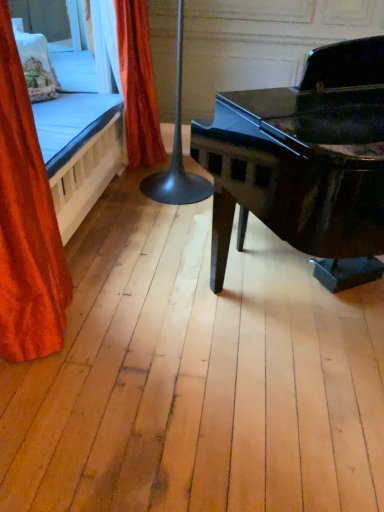
This screenshot has height=512, width=384. Identify the location of orange velvet curtain at left, the second curtain positioned from the back. (26, 224).

Locate an element on the screen. Image resolution: width=384 pixels, height=512 pixels. embroidered fabric pillow at upper left is located at coordinates (37, 66).

I want to click on black glossy table lamp at center, so click(177, 154).

Describe the element at coordinates (138, 84) in the screenshot. I see `orange velvet curtain at upper left, which ranks as the 2th curtain in front-to-back order` at that location.

How much space does orange velvet curtain at upper left, the first curtain in the back-to-front sequence, occupy horizontally?

It is 16.22 inches.

Locate an element on the screen. orange velvet curtain at left, the second curtain positioned from the back is located at coordinates (26, 224).

Can you tell me how much orange velvet curtain at left, the second curtain positioned from the back, and orange velvet curtain at upper left, which ranks as the 2th curtain in front-to-back order, differ in facing direction?

They differ by 0.00102 degrees in their facing directions.

In the scene shown: Considering the relative sizes of orange velvet curtain at left, marked as the 1th curtain in a front-to-back arrangement, and orange velvet curtain at upper left, which ranks as the 2th curtain in front-to-back order, in the image provided, is orange velvet curtain at left, marked as the 1th curtain in a front-to-back arrangement, wider than orange velvet curtain at upper left, which ranks as the 2th curtain in front-to-back order,?

No.

From a real-world perspective, between orange velvet curtain at left, marked as the 1th curtain in a front-to-back arrangement, and orange velvet curtain at upper left, the first curtain in the back-to-front sequence, who is vertically higher?

orange velvet curtain at left, marked as the 1th curtain in a front-to-back arrangement, from a real-world perspective.

Considering the positions of point (3, 185) and point (140, 47), is point (3, 185) closer or farther from the camera than point (140, 47)?

Clearly, point (3, 185) is closer to the camera than point (140, 47).

Can you confirm if black glossy table lamp at center is positioned to the right of orange velvet curtain at upper left, which ranks as the 2th curtain in front-to-back order?

Correct, you'll find black glossy table lamp at center to the right of orange velvet curtain at upper left, which ranks as the 2th curtain in front-to-back order.

Is black glossy table lamp at center bigger or smaller than orange velvet curtain at upper left, which ranks as the 2th curtain in front-to-back order?

Considering their sizes, black glossy table lamp at center takes up more space than orange velvet curtain at upper left, which ranks as the 2th curtain in front-to-back order.

From the image's perspective, between black glossy table lamp at center and orange velvet curtain at upper left, which ranks as the 2th curtain in front-to-back order, who is located below?

black glossy table lamp at center.

From the picture: From a real-world perspective, which object stands above the other?

black glossy table lamp at center.

From the black glossy table lamp at center, count the 2nd curtain to the left and point to it. Please provide its 2D coordinates.

[(26, 224)]

Who is smaller, black glossy table lamp at center or orange velvet curtain at left, the second curtain positioned from the back?

With smaller size is orange velvet curtain at left, the second curtain positioned from the back.

Is black glossy table lamp at center turned away from orange velvet curtain at left, the second curtain positioned from the back?

black glossy table lamp at center does not have its back to orange velvet curtain at left, the second curtain positioned from the back.

Does black glossy table lamp at center have a lesser width compared to orange velvet curtain at left, the second curtain positioned from the back?

In fact, black glossy table lamp at center might be wider than orange velvet curtain at left, the second curtain positioned from the back.

Is embroidered fabric pillow at upper left oriented away from orange velvet curtain at upper left, the first curtain in the back-to-front sequence?

No, embroidered fabric pillow at upper left's orientation is not away from orange velvet curtain at upper left, the first curtain in the back-to-front sequence.

From the image's perspective, starting from the embroidered fabric pillow at upper left, which curtain is the 1st one below? Please provide its 2D coordinates.

[(138, 84)]

Does embroidered fabric pillow at upper left appear on the left side of orange velvet curtain at upper left, the first curtain in the back-to-front sequence?

Correct, you'll find embroidered fabric pillow at upper left to the left of orange velvet curtain at upper left, the first curtain in the back-to-front sequence.

Is orange velvet curtain at left, marked as the 1th curtain in a front-to-back arrangement, situated inside embroidered fabric pillow at upper left or outside?

orange velvet curtain at left, marked as the 1th curtain in a front-to-back arrangement, is outside embroidered fabric pillow at upper left.

From the image's perspective, is orange velvet curtain at left, marked as the 1th curtain in a front-to-back arrangement, positioned above or below embroidered fabric pillow at upper left?

orange velvet curtain at left, marked as the 1th curtain in a front-to-back arrangement, is situated lower than embroidered fabric pillow at upper left in the image.

Measure the distance from orange velvet curtain at left, the second curtain positioned from the back, to embroidered fabric pillow at upper left.

They are 1.35 meters apart.

Is orange velvet curtain at left, marked as the 1th curtain in a front-to-back arrangement, to the left of embroidered fabric pillow at upper left from the viewer's perspective?

No.

Based on their positions, is embroidered fabric pillow at upper left located to the left or right of black glossy table lamp at center?

Clearly, embroidered fabric pillow at upper left is on the left of black glossy table lamp at center in the image.

From the image's perspective, is embroidered fabric pillow at upper left positioned above or below black glossy table lamp at center?

From the image's perspective, embroidered fabric pillow at upper left appears above black glossy table lamp at center.

From the picture: How distant is embroidered fabric pillow at upper left from black glossy table lamp at center?

embroidered fabric pillow at upper left is 36.49 inches from black glossy table lamp at center.

Does embroidered fabric pillow at upper left have a smaller size compared to black glossy table lamp at center?

Yes, embroidered fabric pillow at upper left is smaller than black glossy table lamp at center.

Is orange velvet curtain at upper left, the first curtain in the back-to-front sequence, placed right next to embroidered fabric pillow at upper left?

There is a gap between orange velvet curtain at upper left, the first curtain in the back-to-front sequence, and embroidered fabric pillow at upper left.

Is orange velvet curtain at upper left, the first curtain in the back-to-front sequence, aimed at embroidered fabric pillow at upper left?

No, orange velvet curtain at upper left, the first curtain in the back-to-front sequence, is not turned towards embroidered fabric pillow at upper left.

Can you confirm if orange velvet curtain at upper left, the first curtain in the back-to-front sequence, is wider than embroidered fabric pillow at upper left?

Yes.

Is orange velvet curtain at upper left, the first curtain in the back-to-front sequence, taller than embroidered fabric pillow at upper left?

Indeed, orange velvet curtain at upper left, the first curtain in the back-to-front sequence, has a greater height compared to embroidered fabric pillow at upper left.

At what (x,y) coordinates should I click in order to perform the action: click on curtain that is below the orange velvet curtain at upper left, which ranks as the 2th curtain in front-to-back order (from the image's perspective). Please return your answer as a coordinate pair (x, y). The height and width of the screenshot is (512, 384). Looking at the image, I should click on (26, 224).

Locate an element on the screen. The width and height of the screenshot is (384, 512). curtain below the black glossy table lamp at center (from a real-world perspective) is located at coordinates coord(138,84).

In the scene shown: Which object lies further to the anchor point black glossy table lamp at center, orange velvet curtain at upper left, which ranks as the 2th curtain in front-to-back order, or orange velvet curtain at left, the second curtain positioned from the back?

The object further to black glossy table lamp at center is orange velvet curtain at left, the second curtain positioned from the back.

Looking at the image, which one is located closer to embroidered fabric pillow at upper left, orange velvet curtain at upper left, which ranks as the 2th curtain in front-to-back order, or black glossy table lamp at center?

Based on the image, orange velvet curtain at upper left, which ranks as the 2th curtain in front-to-back order, appears to be nearer to embroidered fabric pillow at upper left.

Looking at the image, which one is located closer to orange velvet curtain at upper left, which ranks as the 2th curtain in front-to-back order, embroidered fabric pillow at upper left or orange velvet curtain at left, marked as the 1th curtain in a front-to-back arrangement?

embroidered fabric pillow at upper left is closer to orange velvet curtain at upper left, which ranks as the 2th curtain in front-to-back order.

Considering their positions, is orange velvet curtain at upper left, which ranks as the 2th curtain in front-to-back order, positioned further to orange velvet curtain at left, marked as the 1th curtain in a front-to-back arrangement, than embroidered fabric pillow at upper left?

The object further to orange velvet curtain at left, marked as the 1th curtain in a front-to-back arrangement, is orange velvet curtain at upper left, which ranks as the 2th curtain in front-to-back order.

From the image, which object appears to be nearer to embroidered fabric pillow at upper left, black glossy table lamp at center or orange velvet curtain at left, the second curtain positioned from the back?

The object closer to embroidered fabric pillow at upper left is black glossy table lamp at center.

When comparing their distances from orange velvet curtain at left, marked as the 1th curtain in a front-to-back arrangement, does black glossy table lamp at center or orange velvet curtain at upper left, which ranks as the 2th curtain in front-to-back order, seem closer?

The object closer to orange velvet curtain at left, marked as the 1th curtain in a front-to-back arrangement, is black glossy table lamp at center.

Considering their positions, is orange velvet curtain at left, the second curtain positioned from the back, positioned further to embroidered fabric pillow at upper left than orange velvet curtain at upper left, the first curtain in the back-to-front sequence?

orange velvet curtain at left, the second curtain positioned from the back, lies further to embroidered fabric pillow at upper left than the other object.

Considering their positions, is orange velvet curtain at upper left, which ranks as the 2th curtain in front-to-back order, positioned further to black glossy table lamp at center than embroidered fabric pillow at upper left?

embroidered fabric pillow at upper left is positioned further to the anchor black glossy table lamp at center.

The height and width of the screenshot is (512, 384). I want to click on curtain between orange velvet curtain at left, marked as the 1th curtain in a front-to-back arrangement, and embroidered fabric pillow at upper left, along the z-axis, so click(x=138, y=84).

The width and height of the screenshot is (384, 512). Find the location of `table lamp between orange velvet curtain at left, the second curtain positioned from the back, and embroidered fabric pillow at upper left in the front-back direction`. table lamp between orange velvet curtain at left, the second curtain positioned from the back, and embroidered fabric pillow at upper left in the front-back direction is located at coordinates (177, 154).

The image size is (384, 512). I want to click on table lamp located between orange velvet curtain at left, marked as the 1th curtain in a front-to-back arrangement, and orange velvet curtain at upper left, which ranks as the 2th curtain in front-to-back order, in the depth direction, so click(x=177, y=154).